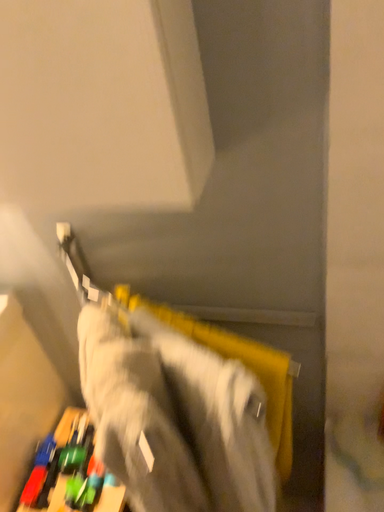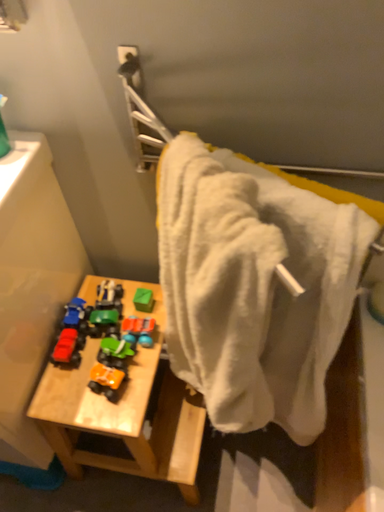
Question: How did the camera likely rotate when shooting the video?

Choices:
 (A) rotated upward
 (B) rotated downward

Answer: (B)